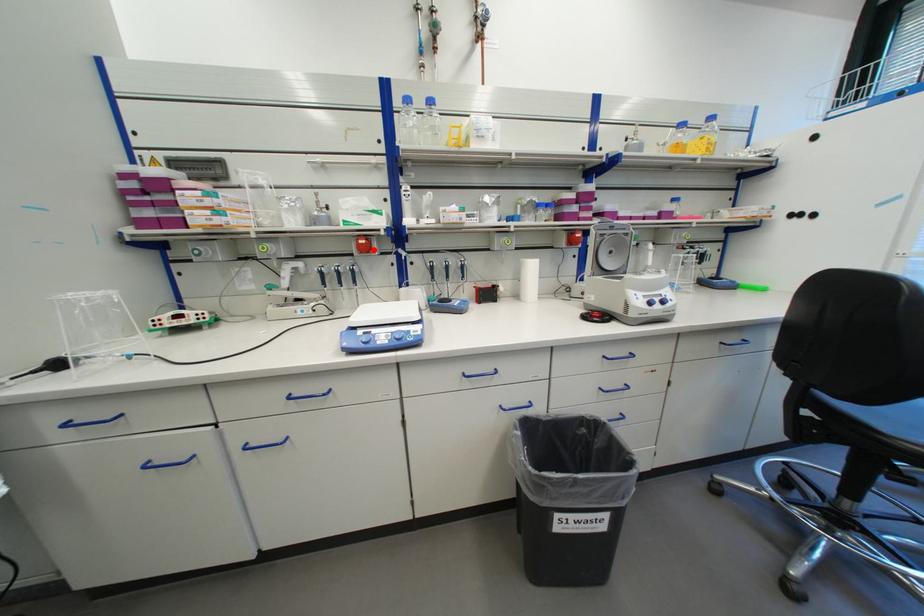
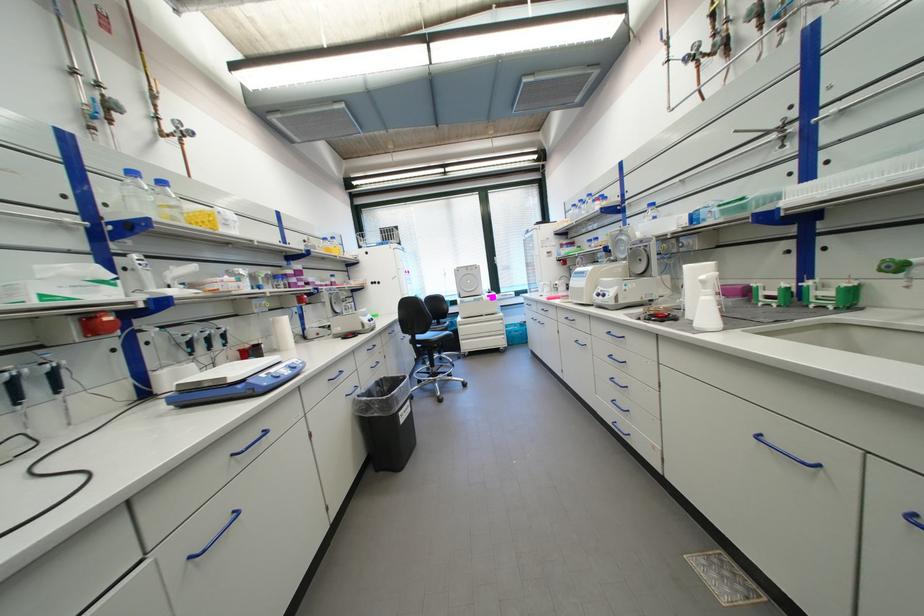
Question: I am providing you with two images of the same scene from different viewpoints. A red point is marked on the first image. Is the red point's position out of view in image 2?

Choices:
 (A) Yes
 (B) No

Answer: (B)